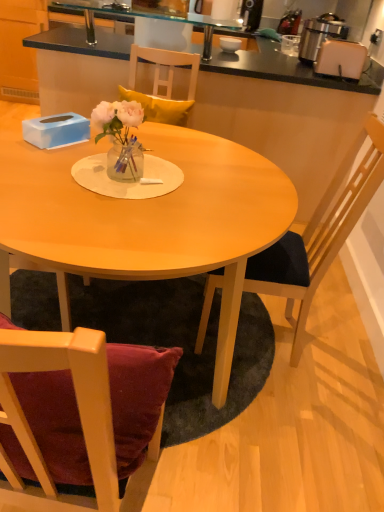
I want to click on vacant space situated above matte wood table at center (from a real-world perspective), so click(157, 178).